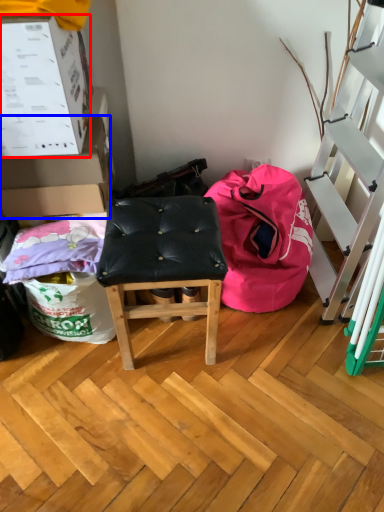
Question: Which object appears closest to the camera in this image, box (highlighted by a red box) or box (highlighted by a blue box)?

Choices:
 (A) box
 (B) box

Answer: (A)